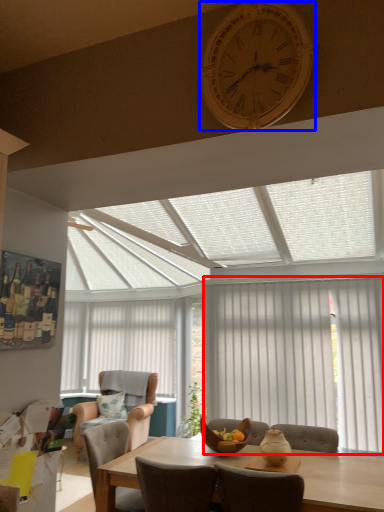
Question: Which of the following is the farthest to the observer, curtain (highlighted by a red box) or clock (highlighted by a blue box)?

Choices:
 (A) curtain
 (B) clock

Answer: (A)